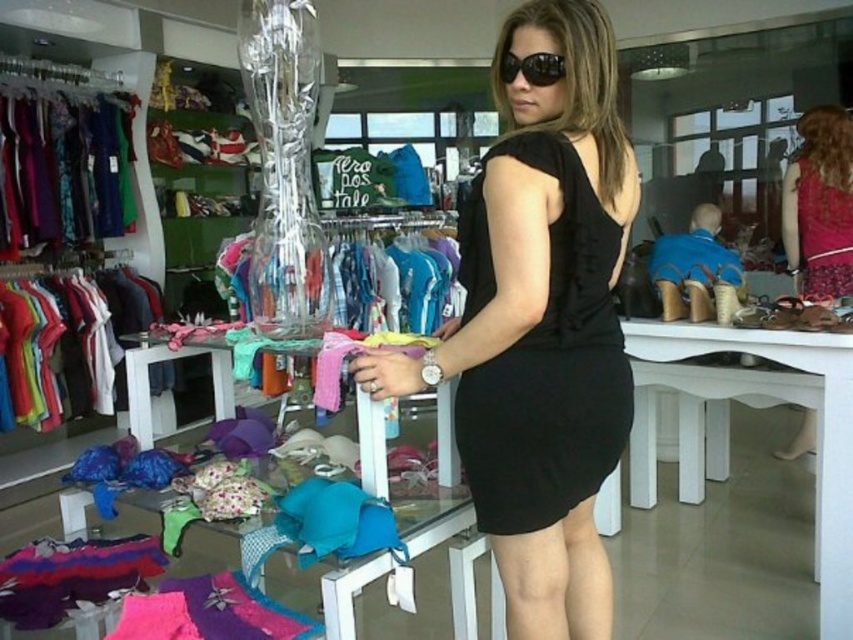
Question: Which object appears closest to the camera in this image?

Choices:
 (A) black reflective sunglasses at center
 (B) black matte dress at center
 (C) matte pink dress at center
 (D) metallic silver dress at center

Answer: (B)

Question: Can you confirm if floral fabric dress at center is positioned below leather sandals at center?

Choices:
 (A) no
 (B) yes

Answer: (A)

Question: Considering the real-world distances, which object is closest to the black reflective sunglasses at center?

Choices:
 (A) matte pink dress at center
 (B) leather sandals at center
 (C) matte purple dress at left

Answer: (B)

Question: Does matte purple dress at left appear over floral fabric dress at center?

Choices:
 (A) yes
 (B) no

Answer: (A)

Question: Can you confirm if matte white shirts at left is smaller than leather sandals at center?

Choices:
 (A) yes
 (B) no

Answer: (B)

Question: Which object is the closest to the metallic silver dress at center?

Choices:
 (A) black reflective sunglasses at center
 (B) leather sandals at center
 (C) matte pink dress at center
 (D) black satin dress at center

Answer: (B)